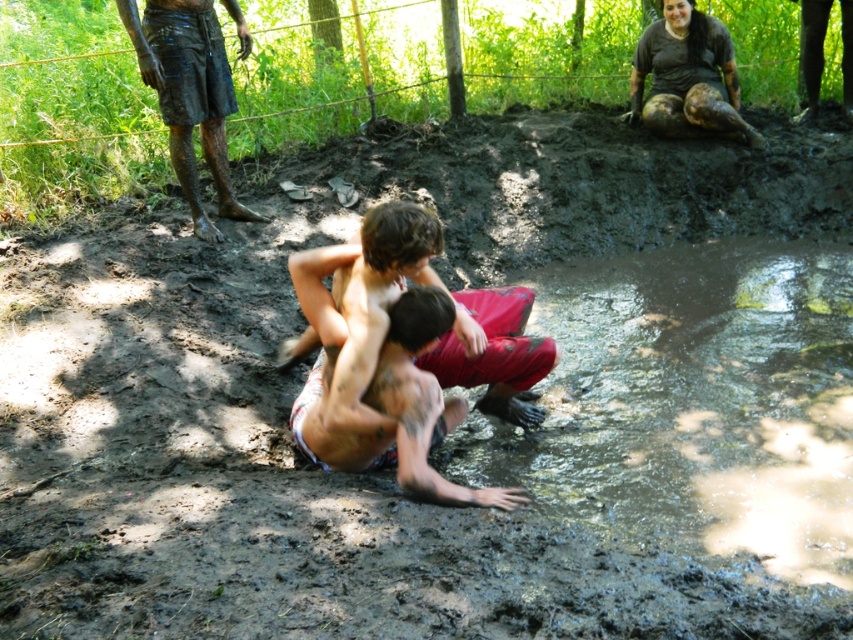
You are a photographer trying to capture a candid shot of the shiny skin child at center and the muddy shorts at upper left. Since you want to ensure both subjects are in focus, which one should you adjust your camera focus on first considering their sizes?

The shiny skin child at center has a lesser height compared to muddy shorts at upper left, so you should focus on the muddy shorts at upper left first as it is larger in the frame.

You are a photographer trying to capture a clear shot of both the shiny skin child at center and the shiny skin squat at center. Which one will appear closer to the camera in the photo?

The shiny skin child at center will appear closer to the camera because it is further to the viewer than the shiny skin squat at center, meaning it is positioned nearer to the photographer.